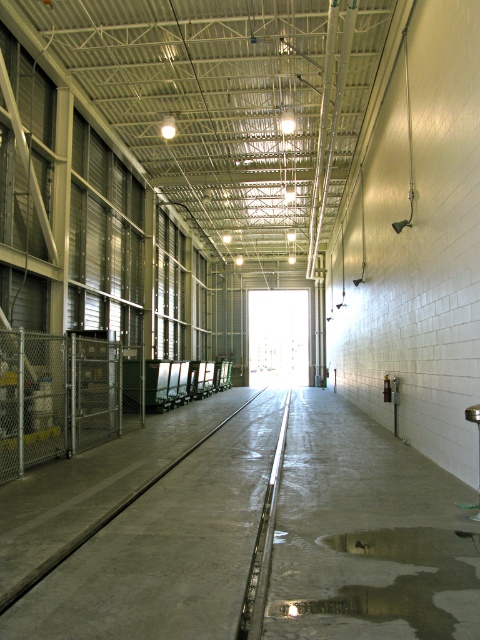
Question: Does gray concrete rail at center appear over glossy concrete puddle at lower center?

Choices:
 (A) no
 (B) yes

Answer: (A)

Question: Which of the following is the farthest from the observer?

Choices:
 (A) (153, 596)
 (B) (261, 525)
 (C) (440, 634)

Answer: (B)

Question: Can you confirm if glossy concrete puddle at lower center is positioned above black metal rail at center?

Choices:
 (A) yes
 (B) no

Answer: (A)

Question: Among these objects, which one is farthest from the camera?

Choices:
 (A) glossy concrete puddle at lower center
 (B) black metal rail at center

Answer: (B)

Question: Which point appears farthest from the camera in this image?

Choices:
 (A) (163, 536)
 (B) (327, 602)
 (C) (273, 522)

Answer: (C)

Question: Can you confirm if glossy concrete puddle at lower center is positioned below black metal rail at center?

Choices:
 (A) no
 (B) yes

Answer: (A)